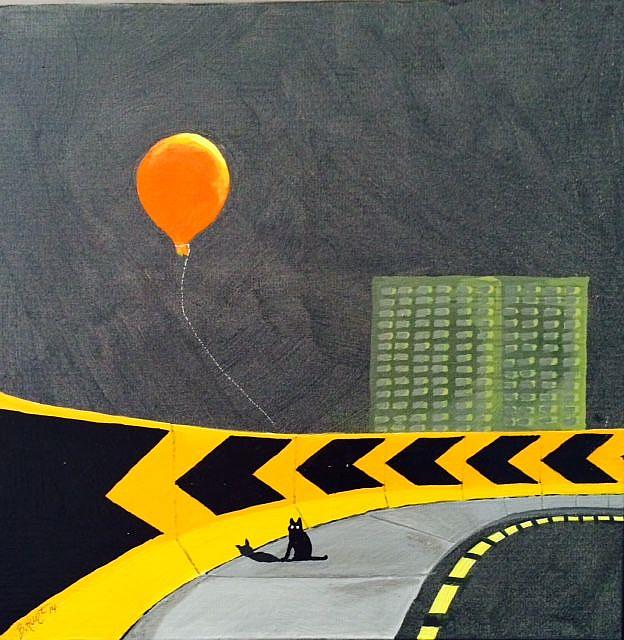
Find the location of a particular element. The width and height of the screenshot is (624, 640). yellow paint on wall is located at coordinates (150, 502).